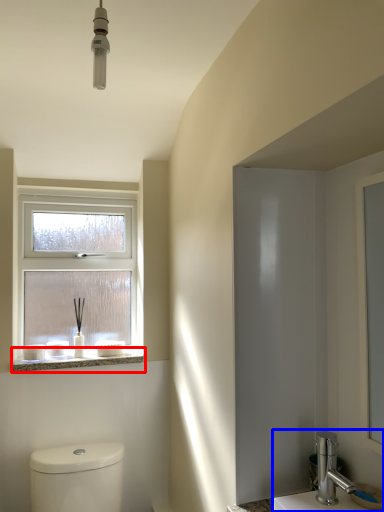
Question: Which object appears closest to the camera in this image, window sill (highlighted by a red box) or sink (highlighted by a blue box)?

Choices:
 (A) window sill
 (B) sink

Answer: (B)